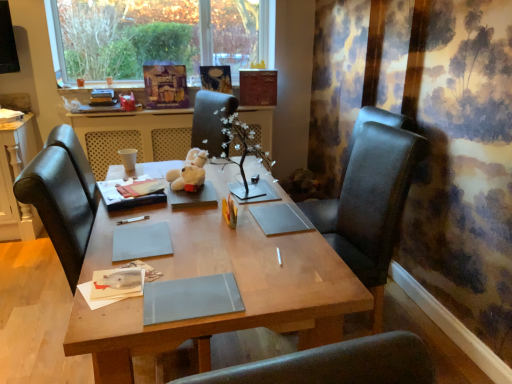
This screenshot has height=384, width=512. In order to click on free space above matte gray notebook at center, positioned as the second notebook in left-to-right order (from a real-world perspective) in this screenshot , I will do pos(199,288).